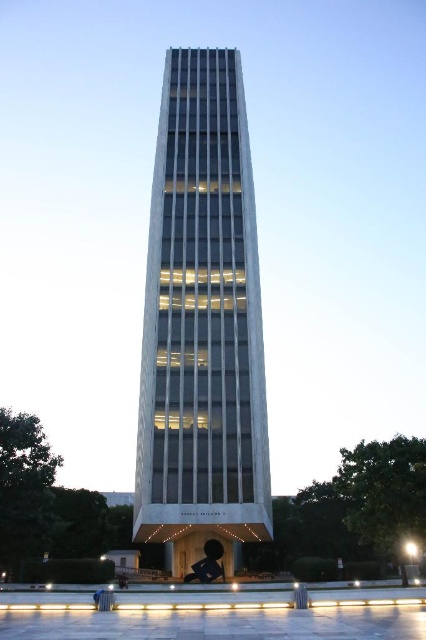
Can you confirm if white glass tower at center is positioned above black glossy statue at center?

Yes, white glass tower at center is above black glossy statue at center.

Is white glass tower at center positioned behind black glossy statue at center?

No, it is not.

Is point (184, 356) positioned behind point (206, 564)?

No, it is not.

The height and width of the screenshot is (640, 426). Find the location of `white glass tower at center`. white glass tower at center is located at coordinates (201, 323).